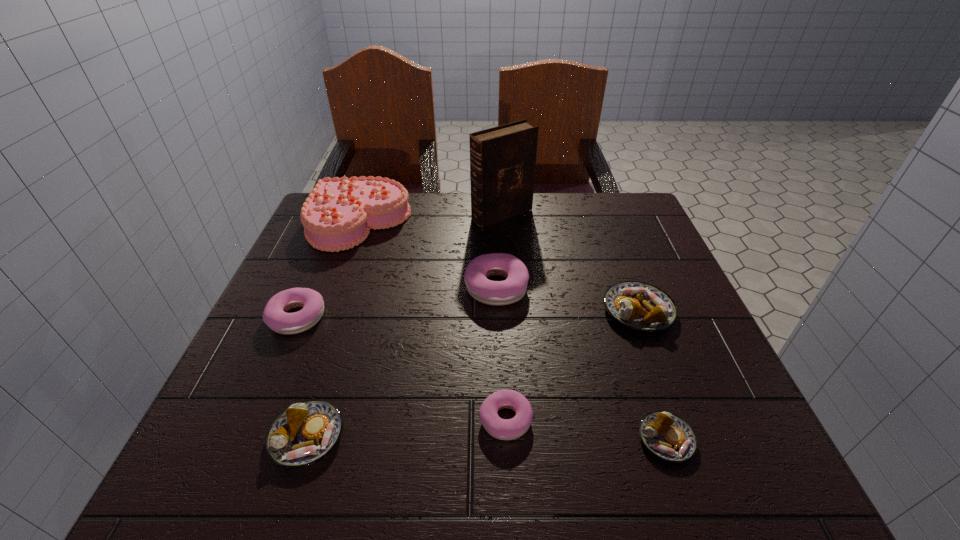
This screenshot has width=960, height=540. I want to click on the tallest object, so click(502, 159).

Find the location of a particular element. the second tallest object is located at coordinates (339, 213).

You are a GUI agent. You are given a task and a screenshot of the screen. Output one action in this format:
    pyautogui.click(x=<x>, y=<y>)
    Task: Click on the biggest pink pastry
    Image resolution: width=960 pixels, height=540 pixels.
    Given the screenshot: What is the action you would take?
    pyautogui.click(x=511, y=290)

You are a GUI agent. You are given a task and a screenshot of the screen. Output one action in this format:
    pyautogui.click(x=<x>, y=<y>)
    Task: Click on the biggest brown pastry
    
    Given the screenshot: What is the action you would take?
    pyautogui.click(x=640, y=306)

At what (x,y) coordinates should I click in order to perform the action: click on the leftmost pink pastry. Please return your answer as a coordinate pair (x, y). This screenshot has width=960, height=540. Looking at the image, I should click on (275, 317).

You are a GUI agent. You are given a task and a screenshot of the screen. Output one action in this format:
    pyautogui.click(x=<x>, y=<y>)
    Task: Click on the leftmost brown pastry
    The image size is (960, 540).
    Given the screenshot: What is the action you would take?
    pyautogui.click(x=306, y=432)

Where is `the nearest pink pastry`? This screenshot has width=960, height=540. the nearest pink pastry is located at coordinates (504, 429).

Find the location of `the smallest brown pastry`. the smallest brown pastry is located at coordinates (667, 436).

I want to click on vacant space situated 0.070m on the front of the Bible, so click(504, 244).

You are a GUI agent. You are given a task and a screenshot of the screen. Output one action in this format:
    pyautogui.click(x=<x>, y=<y>)
    Task: Click on the free space located 0.320m on the right of the cake
    The image size is (960, 540).
    Given the screenshot: What is the action you would take?
    pyautogui.click(x=528, y=222)